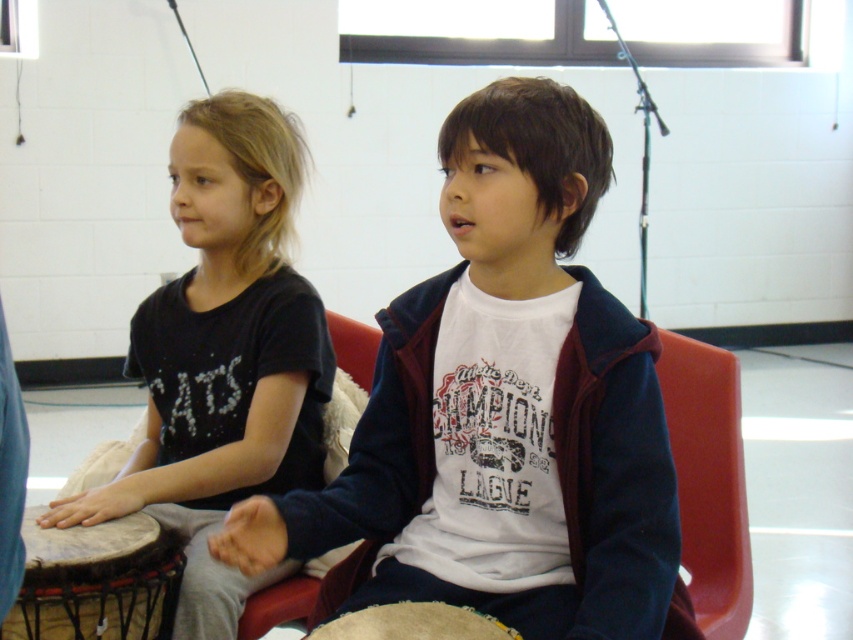
You are a photographer setting up a camera to capture the children in the scene. The camera has a fixed width of 1 meter. If you want to frame both the white cotton shirt at center and the natural wood drum at lower left in the same shot without moving the camera, will the total width required to include both objects fit within the camera frame?

The white cotton shirt at center might be wider than the natural wood drum at lower left, so the total width required to include both could exceed the camera frame of 1 meter. It depends on their combined widths, but since the shirt might be wider, there is a possibility that the total width is too large to fit within the frame.

You are a photographer setting up for a group photo. You see the white cotton shirt at center and the black matte shirt at left. Which shirt should you adjust to ensure both are centered in the frame?

The black matte shirt at left should be moved to the right to align with the white cotton shirt at center, as the white cotton shirt at center is already positioned to the right of the black matte shirt at left.